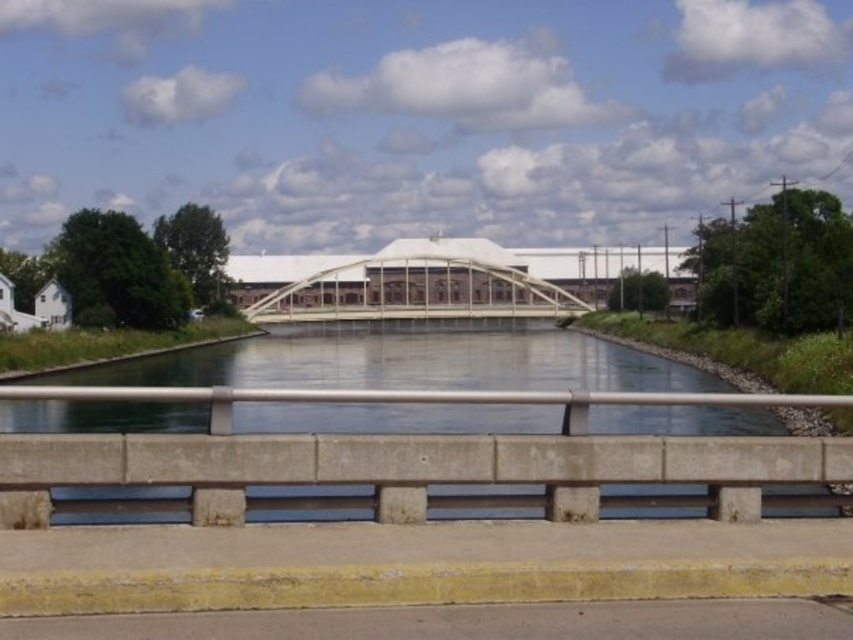
You are standing on the white metal bridge at center and want to see the clear concrete water at center. In which direction should you look?

You should look downward to see the clear concrete water at center since it is located below the white metal bridge at center.

You are a delivery truck driver who needs to cross the white metal bridge at center with a load that requires a clearance of 16 feet. Can you safely pass under the bridge without hitting the clear concrete water at center?

The distance between the white metal bridge at center and the clear concrete water at center is 64.27 feet, which is significantly higher than the 16 feet clearance required. Therefore, you can safely pass under the bridge without any issues.

You are a boat operator trying to navigate a boat that is 5 meters long through the canal. The boat needs to pass between the clear concrete water at center and the industrial building with white roof in the background. Can the boat safely navigate this path?

The clear concrete water at center and the industrial building with white roof in the background are 8.34 meters apart. Since the boat is 5 meters long, it can safely navigate the path as the distance between them is wider than the boat.